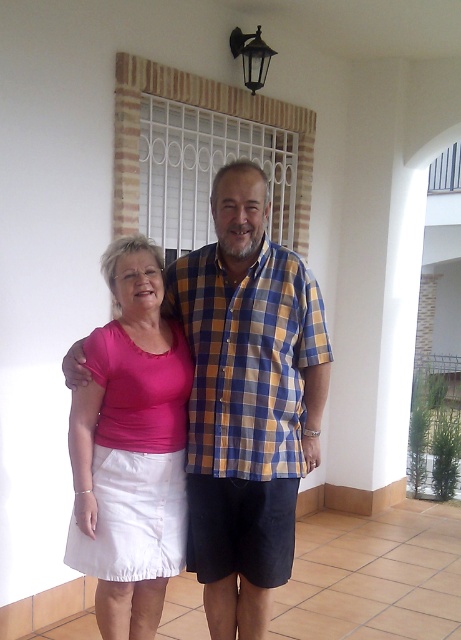
Question: Is pink cotton shirt at center closer to the viewer compared to pink fabric skirt at lower left?

Choices:
 (A) yes
 (B) no

Answer: (B)

Question: Is pink cotton shirt at center positioned in front of pink fabric skirt at lower left?

Choices:
 (A) no
 (B) yes

Answer: (A)

Question: Is pink cotton shirt at center to the left of pink fabric skirt at lower left from the viewer's perspective?

Choices:
 (A) yes
 (B) no

Answer: (B)

Question: Which point appears farthest from the camera in this image?

Choices:
 (A) (116, 412)
 (B) (299, 340)

Answer: (B)

Question: Which of the following is the closest to the observer?

Choices:
 (A) pink fabric skirt at lower left
 (B) pink cotton shirt at center

Answer: (A)